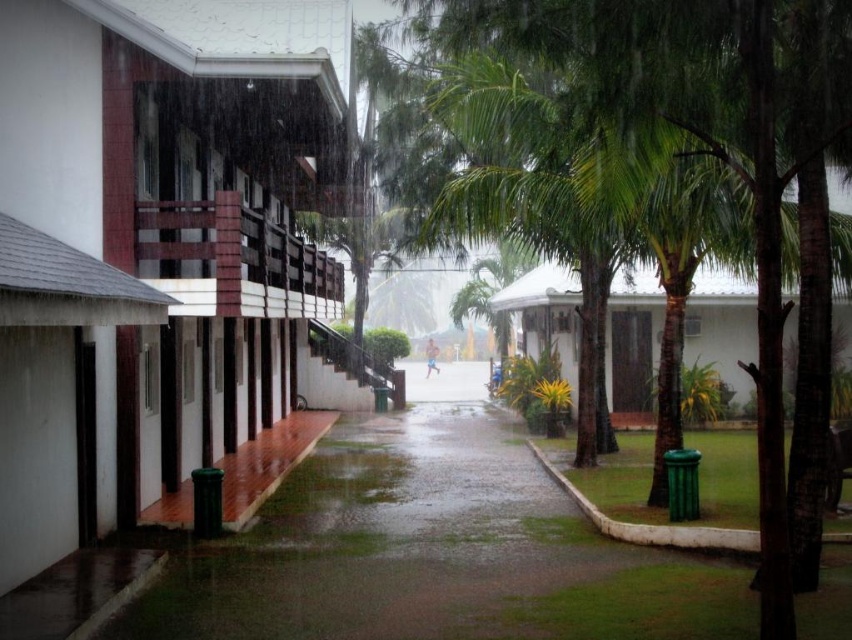
Between point (623, 54) and point (426, 349), which one is positioned in front?

Point (623, 54)

Is green leafy tree at center bigger than smooth skin runner at center?

Yes.

This screenshot has width=852, height=640. I want to click on green leafy tree at center, so click(x=629, y=157).

The width and height of the screenshot is (852, 640). I want to click on green leafy tree at center, so click(x=629, y=157).